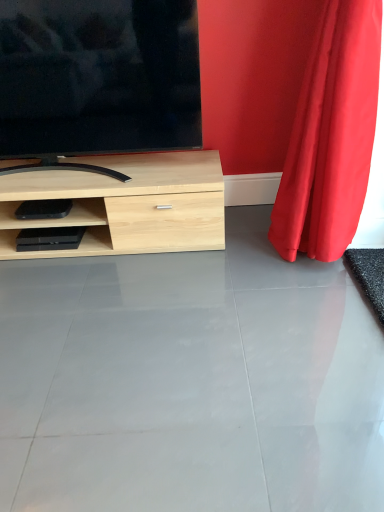
Where is `vacant space in front of red velvet curtain at right`? Image resolution: width=384 pixels, height=512 pixels. vacant space in front of red velvet curtain at right is located at coordinates (311, 322).